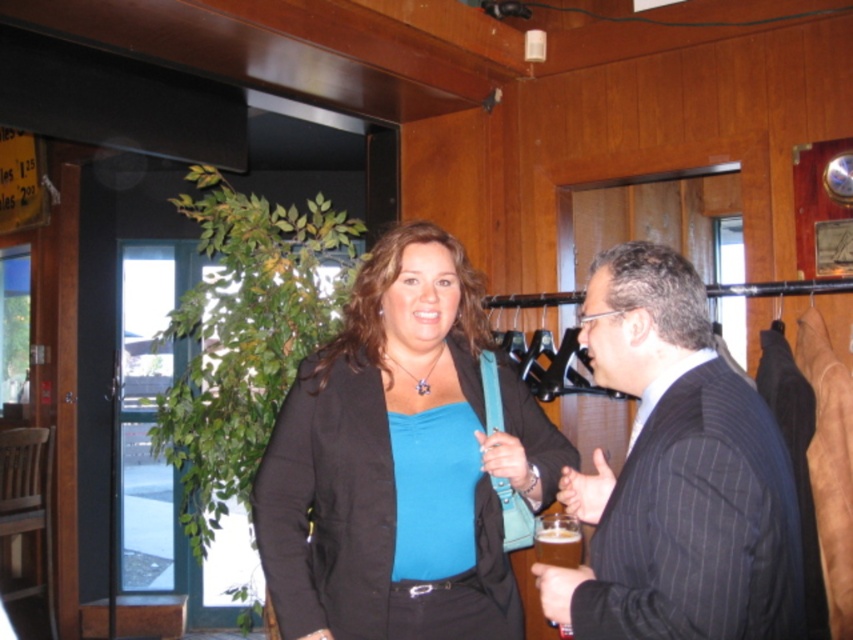
You are standing in the room and want to place a small plant pot at the exact center of the room. The exact center is at point 0.5, 0.5. Where should you place the plant pot relative to the matte black blazer at center?

The exact center of the room is at point (426, 320), while the matte black blazer at center is located at point (399, 461). Therefore, to place the plant pot at the exact center, it should be positioned to the left and slightly above the matte black blazer at center.

You are a photographer in the room and want to take a photo of both the matte black blazer at center and the black pinstripe suit at center. Which one will appear larger in the photo?

The matte black blazer at center will appear larger in the photo because it is positioned under the black pinstripe suit at center, meaning it is closer to the camera.

You are a photographer setting up for a portrait in the room. You need to position the matte black blazer at center and the black pinstripe suit at center so that they are aligned properly. Which object should be placed on the left side to match their current positions?

The matte black blazer at center should be placed on the left side because it is currently to the left of the black pinstripe suit at center.